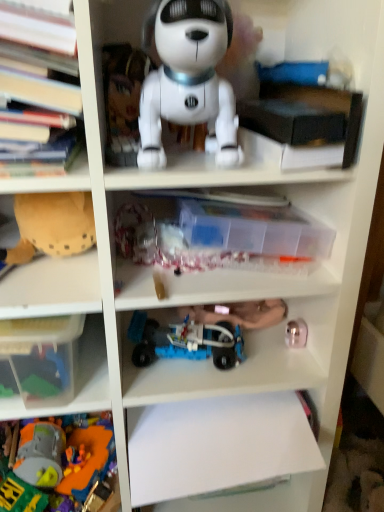
Question: Is blue plastic toy car at center, the 2th toy in the bottom-to-top sequence, aimed at metallic gold toy at lower right, positioned as the 3th toy in top-to-bottom order?

Choices:
 (A) no
 (B) yes

Answer: (A)

Question: Considering the relative sizes of blue plastic toy car at center, the 2th toy in the bottom-to-top sequence, and metallic gold toy at lower right, marked as the third toy in a bottom-to-top arrangement, in the image provided, is blue plastic toy car at center, the 2th toy in the bottom-to-top sequence, shorter than metallic gold toy at lower right, marked as the third toy in a bottom-to-top arrangement,?

Choices:
 (A) yes
 (B) no

Answer: (B)

Question: Is blue plastic toy car at center, the fourth toy positioned from the top, positioned behind metallic gold toy at lower right, positioned as the 3th toy in top-to-bottom order?

Choices:
 (A) no
 (B) yes

Answer: (A)

Question: From a real-world perspective, is blue plastic toy car at center, the 2th toy in the bottom-to-top sequence, positioned under metallic gold toy at lower right, marked as the third toy in a bottom-to-top arrangement, based on gravity?

Choices:
 (A) yes
 (B) no

Answer: (B)

Question: From the image's perspective, is blue plastic toy car at center, the 2th toy in the bottom-to-top sequence, beneath metallic gold toy at lower right, marked as the third toy in a bottom-to-top arrangement?

Choices:
 (A) no
 (B) yes

Answer: (B)

Question: Can we say blue plastic toy car at center, the fourth toy positioned from the top, lies outside metallic gold toy at lower right, marked as the third toy in a bottom-to-top arrangement?

Choices:
 (A) yes
 (B) no

Answer: (A)

Question: Is metallic gold toy at lower right, positioned as the 3th toy in top-to-bottom order, aimed at transparent plastic container at center, arranged as the second book when viewed from the left?

Choices:
 (A) yes
 (B) no

Answer: (B)

Question: From the image's perspective, is metallic gold toy at lower right, positioned as the 3th toy in top-to-bottom order, on transparent plastic container at center, arranged as the second book when viewed from the left?

Choices:
 (A) yes
 (B) no

Answer: (B)

Question: From a real-world perspective, is metallic gold toy at lower right, positioned as the 3th toy in top-to-bottom order, over transparent plastic container at center, arranged as the second book when viewed from the left?

Choices:
 (A) no
 (B) yes

Answer: (A)

Question: Considering the relative sizes of metallic gold toy at lower right, positioned as the 3th toy in top-to-bottom order, and transparent plastic container at center, arranged as the second book when viewed from the left, in the image provided, is metallic gold toy at lower right, positioned as the 3th toy in top-to-bottom order, wider than transparent plastic container at center, arranged as the second book when viewed from the left,?

Choices:
 (A) no
 (B) yes

Answer: (A)

Question: Considering the relative sizes of metallic gold toy at lower right, positioned as the 3th toy in top-to-bottom order, and transparent plastic container at center, which ranks as the second book in right-to-left order, in the image provided, is metallic gold toy at lower right, positioned as the 3th toy in top-to-bottom order, taller than transparent plastic container at center, which ranks as the second book in right-to-left order,?

Choices:
 (A) no
 (B) yes

Answer: (A)

Question: From a real-world perspective, is metallic gold toy at lower right, marked as the third toy in a bottom-to-top arrangement, physically below transparent plastic container at center, which ranks as the second book in right-to-left order?

Choices:
 (A) yes
 (B) no

Answer: (A)

Question: From the image's perspective, is hardcover books at left, the 3th book when ordered from right to left, above translucent plastic storage box at lower left?

Choices:
 (A) yes
 (B) no

Answer: (A)